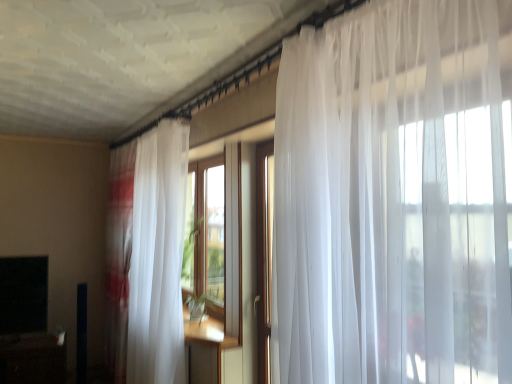
Question: In terms of height, does black matte tv at lower left look taller or shorter compared to black glossy table at lower left?

Choices:
 (A) short
 (B) tall

Answer: (B)

Question: Is black matte tv at lower left wider or thinner than black glossy table at lower left?

Choices:
 (A) thin
 (B) wide

Answer: (A)

Question: Which is farther from the black glossy table at lower left?

Choices:
 (A) black matte tv at lower left
 (B) sheer white curtain at left

Answer: (B)

Question: Estimate the real-world distances between objects in this image. Which object is farther from the black matte tv at lower left?

Choices:
 (A) sheer white curtain at left
 (B) black glossy table at lower left

Answer: (A)